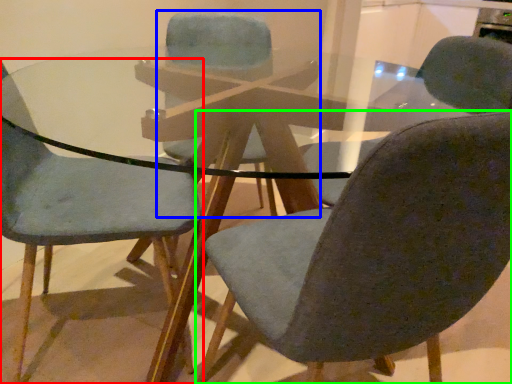
Question: Estimate the real-world distances between objects in this image. Which object is closer to chair (highlighted by a red box), chair (highlighted by a blue box) or chair (highlighted by a green box)?

Choices:
 (A) chair
 (B) chair

Answer: (B)